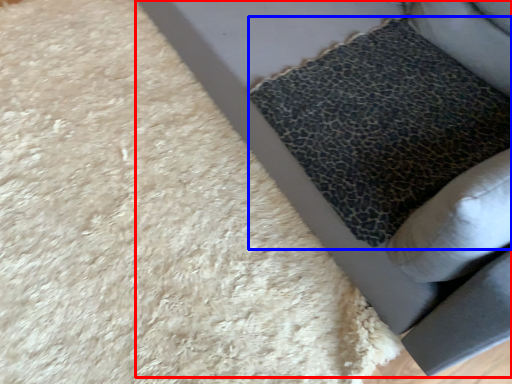
Question: Which object is further to the camera taking this photo, furniture (highlighted by a red box) or pillow (highlighted by a blue box)?

Choices:
 (A) furniture
 (B) pillow

Answer: (B)